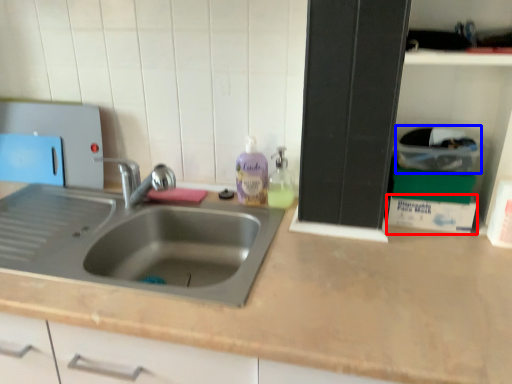
Question: Which of the following is the closest to the observer, box (highlighted by a red box) or box (highlighted by a blue box)?

Choices:
 (A) box
 (B) box

Answer: (B)